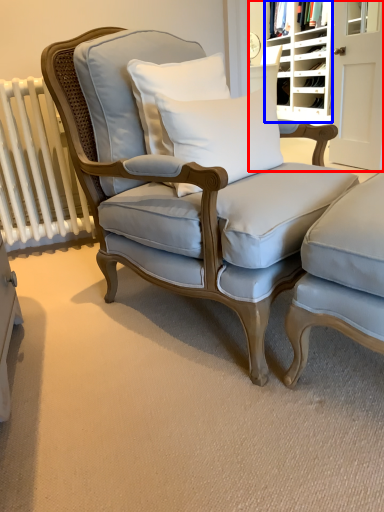
Question: Which of the following is the farthest to the observer, bookshelf (highlighted by a red box) or shelf (highlighted by a blue box)?

Choices:
 (A) bookshelf
 (B) shelf

Answer: (B)